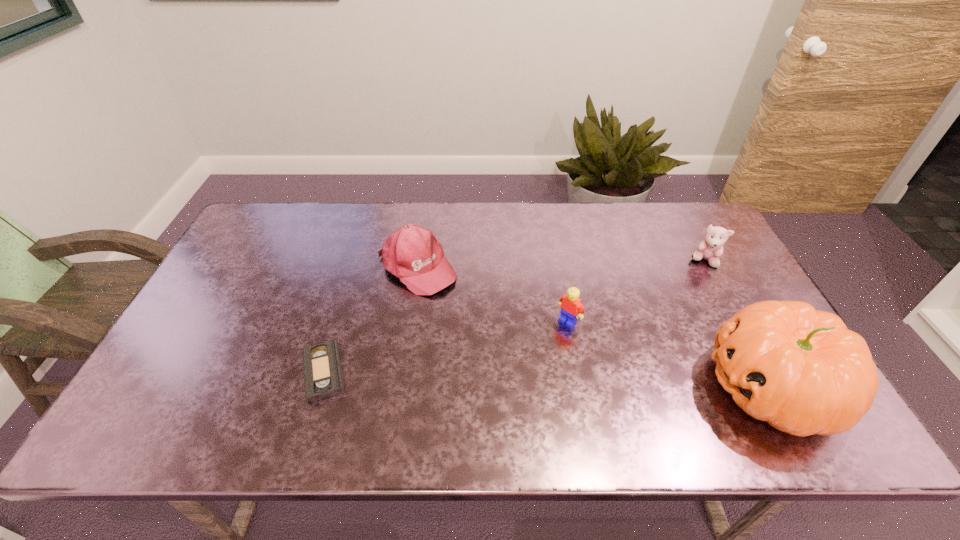
Identify the location of free spot between the Lego and the pumpkin. Image resolution: width=960 pixels, height=540 pixels. point(670,354).

Image resolution: width=960 pixels, height=540 pixels. Find the location of `object that ranks as the fourth closest to the baseball cap`. object that ranks as the fourth closest to the baseball cap is located at coordinates (711, 248).

Select which object appears as the third closest to the teddy bear. Please provide its 2D coordinates. Your answer should be formatted as a tuple, i.e. [(x, y)], where the tuple contains the x and y coordinates of a point satisfying the conditions above.

[(412, 253)]

Where is `vacant area in the image that satisfies the following two spatial constraints: 1. on the front side of the videotape; 2. on the carved face of the pumpkin`? The height and width of the screenshot is (540, 960). vacant area in the image that satisfies the following two spatial constraints: 1. on the front side of the videotape; 2. on the carved face of the pumpkin is located at coordinates (321, 386).

Find the location of `blank area in the image that satisfies the following two spatial constraints: 1. on the back side of the shortest object; 2. on the right side of the teddy bear`. blank area in the image that satisfies the following two spatial constraints: 1. on the back side of the shortest object; 2. on the right side of the teddy bear is located at coordinates (358, 261).